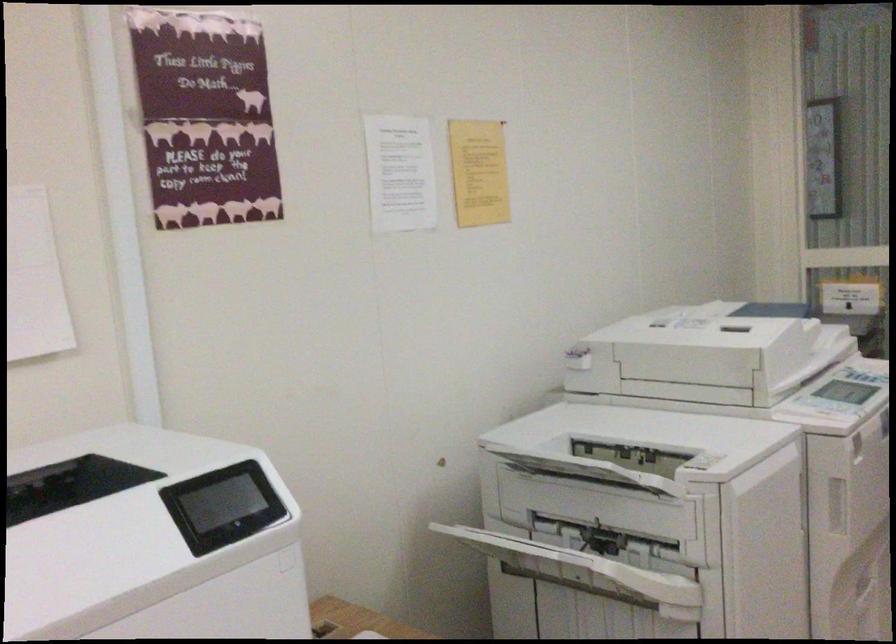
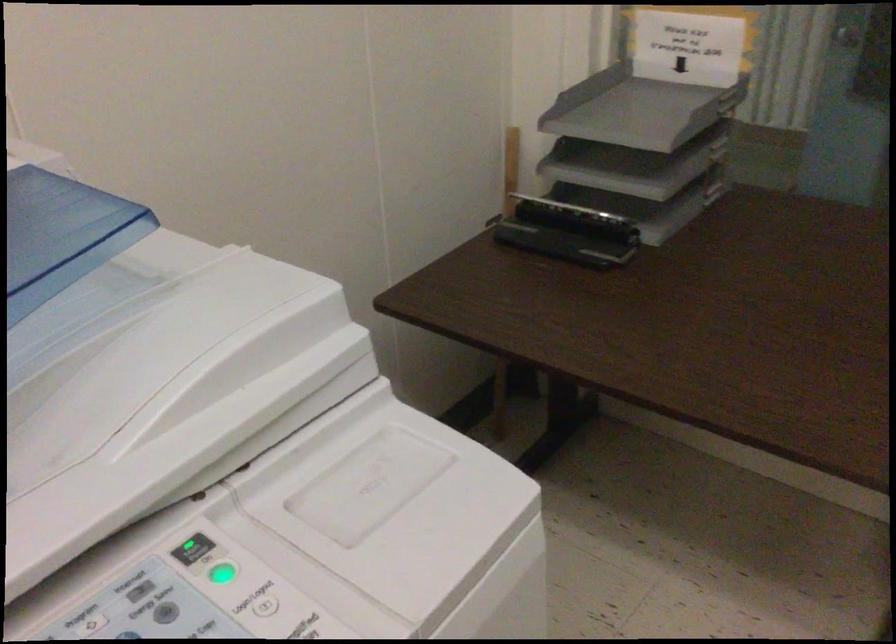
What movement of the cameraman would produce the second image?

The movement direction of the cameraman is right, forward.